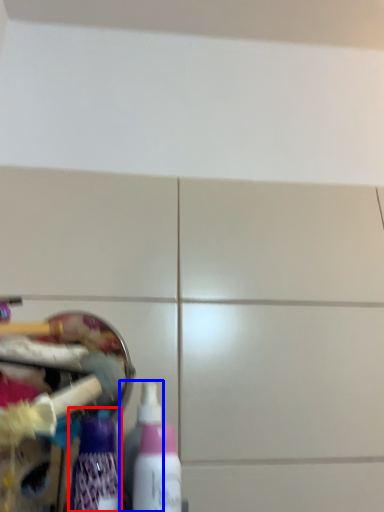
Question: Among these objects, which one is farthest to the camera, bottle (highlighted by a red box) or bottle (highlighted by a blue box)?

Choices:
 (A) bottle
 (B) bottle

Answer: (B)